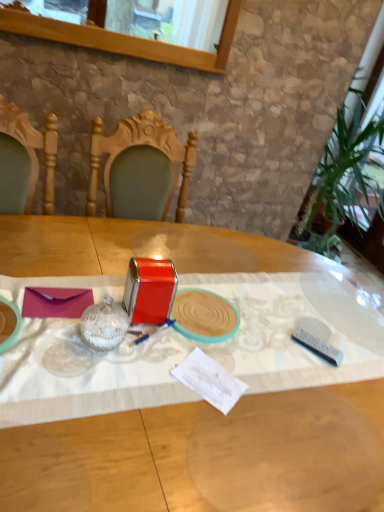
Identify the location of vacant area to the left of metallic red tin at center, the third tableware from the right. Image resolution: width=384 pixels, height=512 pixels. (74, 298).